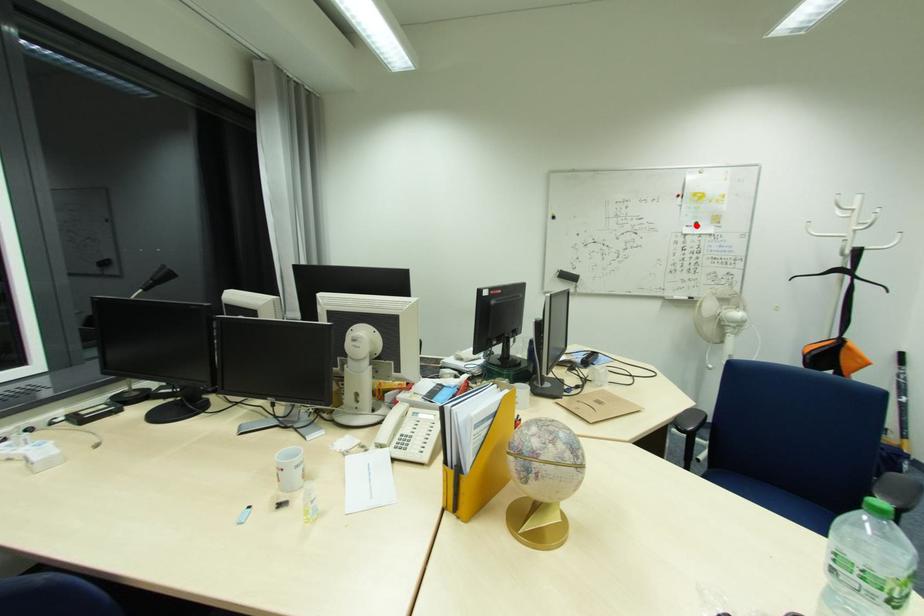
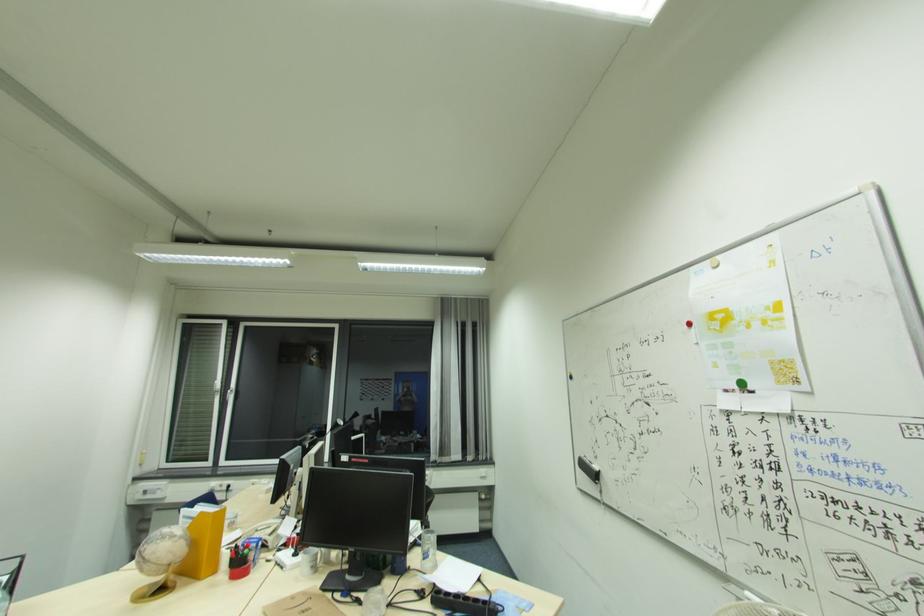
Question: I am providing you with two images of the same scene from different viewpoints. A red point is marked on the first image. At the location where the point appears in image 1, is it still visible in image 2?

Choices:
 (A) Yes
 (B) No

Answer: (A)